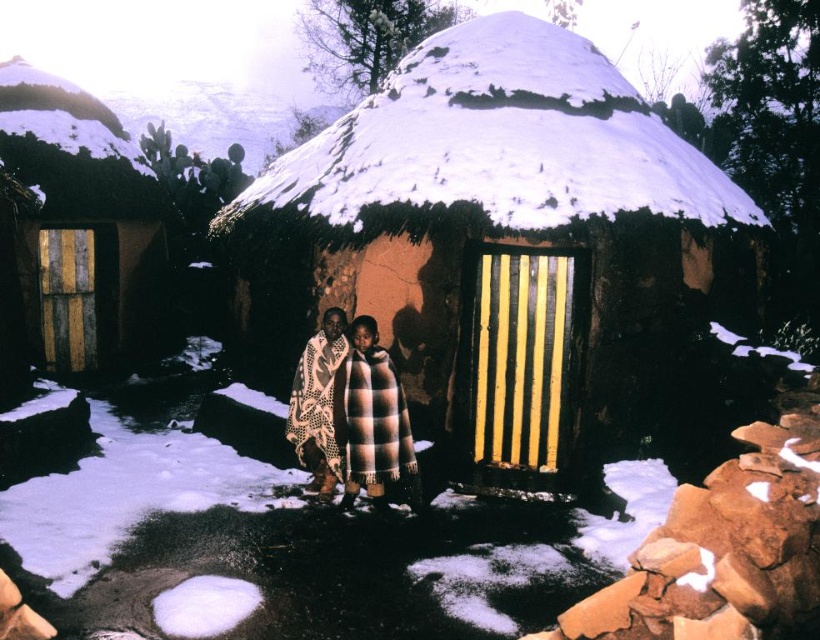
Question: Does wooden door at left appear on the left side of plaid fabric blanket at center?

Choices:
 (A) yes
 (B) no

Answer: (A)

Question: Does plaid wool blanket at center appear on the left side of plaid fabric blanket at center?

Choices:
 (A) no
 (B) yes

Answer: (A)

Question: Among these objects, which one is nearest to the camera?

Choices:
 (A) plaid wool blanket at center
 (B) brown checkered blanket at center
 (C) wooden door at left
 (D) plaid fabric blanket at center

Answer: (B)

Question: In this image, where is plaid wool blanket at center located relative to plaid fabric blanket at center?

Choices:
 (A) above
 (B) below

Answer: (B)

Question: Among these points, which one is farthest from the camera?

Choices:
 (A) (112, 356)
 (B) (376, 451)
 (C) (554, 131)

Answer: (A)

Question: Which of the following is the farthest from the observer?

Choices:
 (A) brown mud hut at center
 (B) plaid fabric blanket at center
 (C) plaid wool blanket at center

Answer: (B)